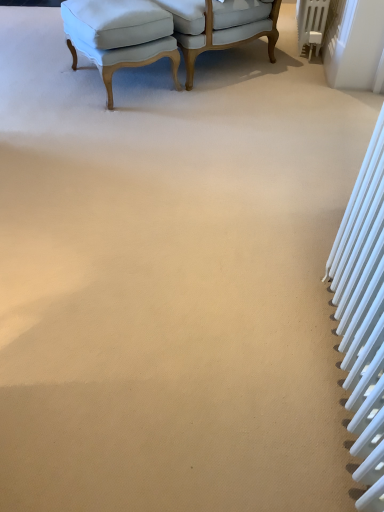
In order to click on free space to the back side of white metallic radiator at right, positioned as the 2th radiator in right-to-left order in this screenshot , I will do `click(271, 243)`.